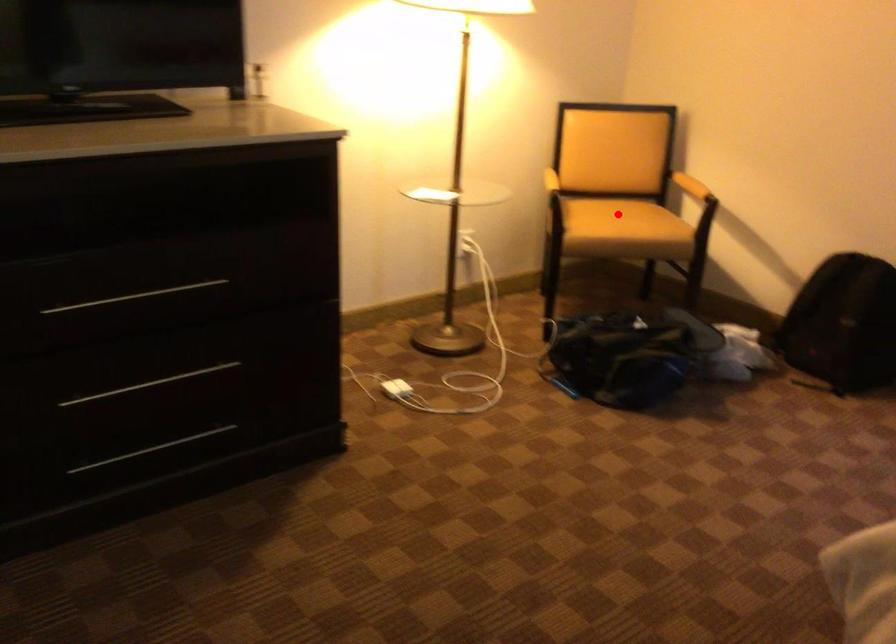
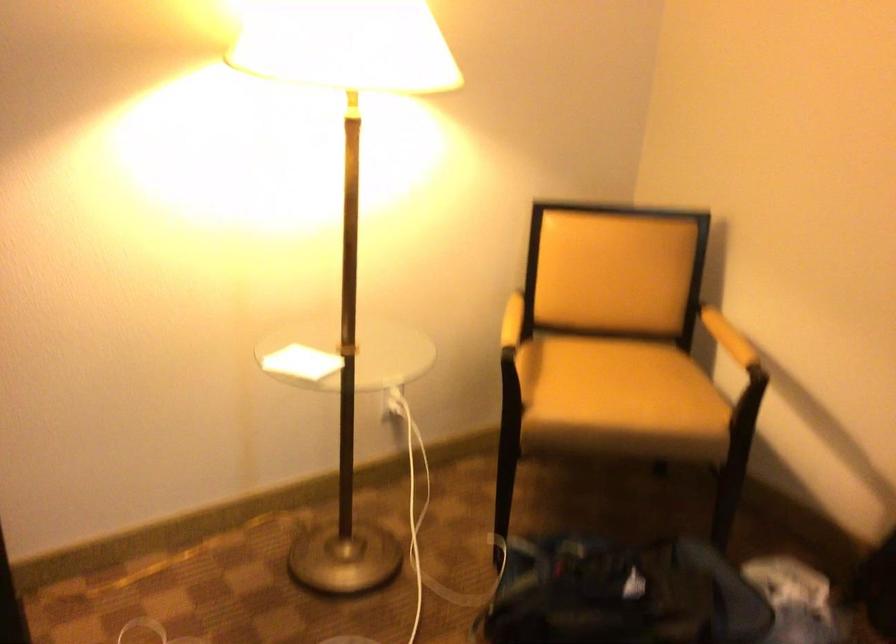
Question: I am providing you with two images of the same scene from different viewpoints. A red point is marked on the first image. Is the red point's position out of view in image 2?

Choices:
 (A) Yes
 (B) No

Answer: (B)